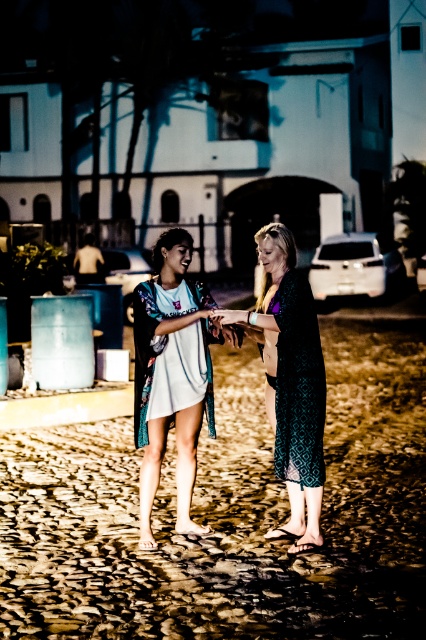
Question: Estimate the real-world distances between objects in this image. Which object is closer to the dark green patterned dress at center?

Choices:
 (A) smooth sand at center
 (B) matte black hair at center

Answer: (B)

Question: Does smooth sand at center lie behind dark green patterned dress at center?

Choices:
 (A) yes
 (B) no

Answer: (B)

Question: Which of the following is the farthest from the observer?

Choices:
 (A) matte teal kimono at center
 (B) dark green patterned dress at center
 (C) matte black phone at center
 (D) patterned fabric dress at center

Answer: (A)

Question: Which object appears farthest from the camera in this image?

Choices:
 (A) matte teal kimono at center
 (B) white matte dress at center
 (C) smooth sand at center

Answer: (B)

Question: Can you confirm if smooth sand at center is positioned below matte black hair at center?

Choices:
 (A) no
 (B) yes

Answer: (B)

Question: Is the position of patterned fabric dress at center more distant than that of white matte dress at center?

Choices:
 (A) no
 (B) yes

Answer: (A)